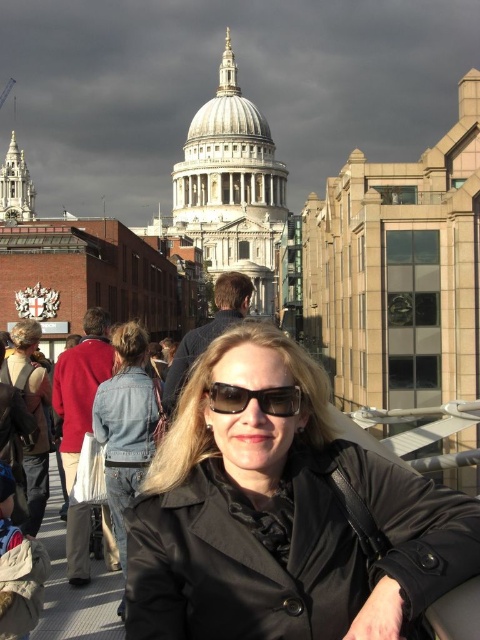
Question: Based on their relative distances, which object is nearer to the denim jacket at center?

Choices:
 (A) black matte jacket at center
 (B) black plastic sunglasses at center

Answer: (A)

Question: Which point is farther to the camera?

Choices:
 (A) black matte jacket at center
 (B) black plastic sunglasses at center

Answer: (B)

Question: Is black matte jacket at center thinner than black plastic sunglasses at center?

Choices:
 (A) yes
 (B) no

Answer: (B)

Question: Is denim jacket at lower left closer to the viewer compared to black plastic sunglasses at center?

Choices:
 (A) no
 (B) yes

Answer: (A)

Question: Can you confirm if denim jacket at center is positioned above black plastic sunglasses at center?

Choices:
 (A) yes
 (B) no

Answer: (B)

Question: Estimate the real-world distances between objects in this image. Which object is closer to the denim jacket at center?

Choices:
 (A) denim jacket at lower left
 (B) black matte jacket at center

Answer: (A)